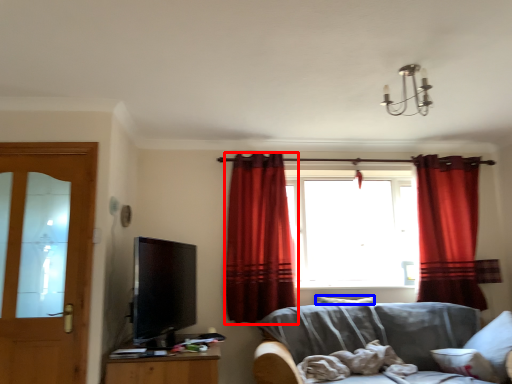
Question: Which of the following is the farthest to the observer, curtain (highlighted by a red box) or pillow (highlighted by a blue box)?

Choices:
 (A) curtain
 (B) pillow

Answer: (B)